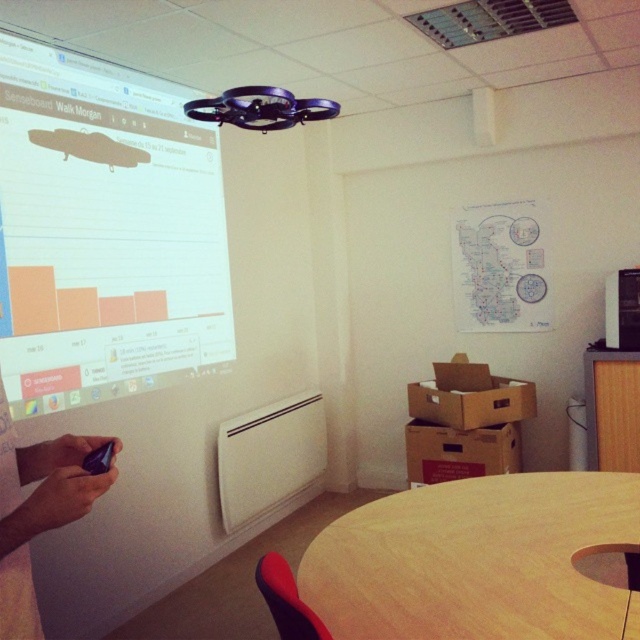
Question: Considering the real-world distances, which object is farthest from the black matte phone at lower left?

Choices:
 (A) wooden round table at lower center
 (B) white glossy projection screen at upper left

Answer: (B)

Question: Which point is closer to the camera?

Choices:
 (A) wooden round table at lower center
 (B) black matte phone at lower left
 (C) white glossy projection screen at upper left

Answer: (B)

Question: Can you confirm if wooden round table at lower center is positioned to the right of black matte phone at lower left?

Choices:
 (A) no
 (B) yes

Answer: (B)

Question: Does wooden round table at lower center have a smaller size compared to black matte phone at lower left?

Choices:
 (A) no
 (B) yes

Answer: (A)

Question: Which point appears closest to the camera in this image?

Choices:
 (A) (481, 540)
 (B) (24, 483)
 (C) (65, 157)

Answer: (B)

Question: Is white glossy projection screen at upper left bigger than wooden round table at lower center?

Choices:
 (A) yes
 (B) no

Answer: (A)